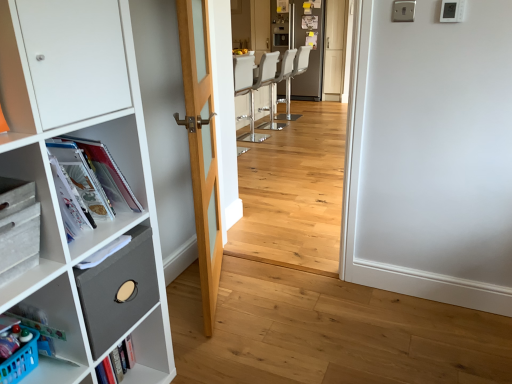
This screenshot has height=384, width=512. Identify the location of free location in front of natural wood door at center. (244, 349).